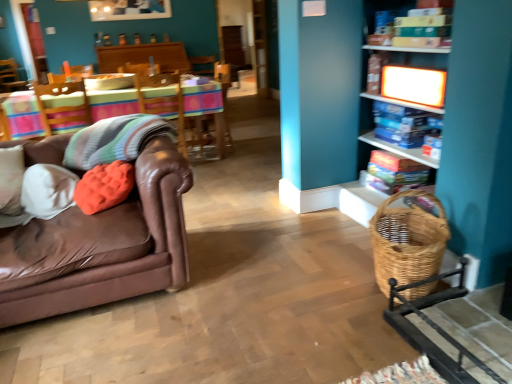
From the picture: Measure the distance between point (85, 149) and camera.

A distance of 2.34 meters exists between point (85, 149) and camera.

Where is `woven brown basket at lower right`? woven brown basket at lower right is located at coordinates (407, 241).

Describe the element at coordinates (407, 241) in the screenshot. This screenshot has width=512, height=384. I see `woven brown basket at lower right` at that location.

What is the approximate height of wooden swivel chair at center, the first swivel chair viewed from the right?

26.73 inches.

The height and width of the screenshot is (384, 512). What are the coordinates of `wooden shelf at right, positioned as the 1th shelf in bottom-to-top order` in the screenshot? It's located at (479, 136).

Between wooden chair at upper left and knitted wool blanket at left, which one has larger size?

With larger size is wooden chair at upper left.

Is wooden chair at upper left outside of knitted wool blanket at left?

Yes.

Considering the points (1, 90) and (119, 118), which point is in front, point (1, 90) or point (119, 118)?

The point (119, 118) is more forward.

From the image's perspective, does wooden chair at upper left appear lower than knitted wool blanket at left?

No.

This screenshot has width=512, height=384. What are the coordinates of `pillow lying in front of the knitted wool blanket at left` in the screenshot? It's located at (104, 186).

Looking at this image, from the image's perspective, is knitted wool blanket at left positioned above or below orange fuzzy pillow at left?

knitted wool blanket at left is above orange fuzzy pillow at left.

From a real-world perspective, between knitted wool blanket at left and orange fuzzy pillow at left, who is vertically lower?

From a 3D spatial view, orange fuzzy pillow at left is below.

Is point (424, 107) farther from viewer compared to point (82, 114)?

No, (424, 107) is in front of (82, 114).

Is white glossy shelf at upper right, which is the 2th shelf in top-to-bottom order, smaller than multicolored fabric swivel chair at left, the 2th swivel chair when ordered from right to left?

Yes.

From the image's perspective, which is above, white glossy shelf at upper right, the second shelf positioned from the bottom, or multicolored fabric swivel chair at left, the 2th swivel chair when ordered from right to left?

multicolored fabric swivel chair at left, the 2th swivel chair when ordered from right to left, is shown above in the image.

From a real-world perspective, is white glossy shelf at upper right, the second shelf positioned from the bottom, located higher than multicolored fabric swivel chair at left, the 2th swivel chair when ordered from right to left?

Yes, from a real-world perspective, white glossy shelf at upper right, the second shelf positioned from the bottom, is over multicolored fabric swivel chair at left, the 2th swivel chair when ordered from right to left

Which object is positioned more to the right, multicolored fabric swivel chair at left, the 2th swivel chair when ordered from right to left, or woven brown basket at lower right?

woven brown basket at lower right is more to the right.

Considering the relative positions of multicolored fabric swivel chair at left, positioned as the 1th swivel chair in left-to-right order, and woven brown basket at lower right in the image provided, is multicolored fabric swivel chair at left, positioned as the 1th swivel chair in left-to-right order, in front of woven brown basket at lower right?

No, multicolored fabric swivel chair at left, positioned as the 1th swivel chair in left-to-right order, is further to the viewer.

Looking at this image, between multicolored fabric swivel chair at left, the 2th swivel chair when ordered from right to left, and woven brown basket at lower right, which one has more height?

multicolored fabric swivel chair at left, the 2th swivel chair when ordered from right to left.

Can we say wooden swivel chair at center, the 2th swivel chair from the left, lies outside woven wicker rocking chair at lower right?

wooden swivel chair at center, the 2th swivel chair from the left, is positioned outside woven wicker rocking chair at lower right.

Is wooden swivel chair at center, the 2th swivel chair from the left, in contact with woven wicker rocking chair at lower right?

No, wooden swivel chair at center, the 2th swivel chair from the left, is not making contact with woven wicker rocking chair at lower right.

Between wooden swivel chair at center, the first swivel chair viewed from the right, and woven wicker rocking chair at lower right, which one has smaller width?

Thinner between the two is wooden swivel chair at center, the first swivel chair viewed from the right.

Which object is more forward, wooden swivel chair at center, the 2th swivel chair from the left, or multicolored fabric swivel chair at left, the 2th swivel chair when ordered from right to left?

multicolored fabric swivel chair at left, the 2th swivel chair when ordered from right to left, is in front.

Is wooden swivel chair at center, the first swivel chair viewed from the right, not within multicolored fabric swivel chair at left, the 2th swivel chair when ordered from right to left?

Yes, wooden swivel chair at center, the first swivel chair viewed from the right, is outside of multicolored fabric swivel chair at left, the 2th swivel chair when ordered from right to left.

Between wooden swivel chair at center, the first swivel chair viewed from the right, and multicolored fabric swivel chair at left, positioned as the 1th swivel chair in left-to-right order, which one has smaller size?

Smaller between the two is multicolored fabric swivel chair at left, positioned as the 1th swivel chair in left-to-right order.

From a real-world perspective, which object rests below the other?

wooden swivel chair at center, the first swivel chair viewed from the right, is physically lower.

Based on the photo, from the image's perspective, would you say wooden chair at upper left is shown under multicolored fabric swivel chair at left, the 2th swivel chair when ordered from right to left?

No, from the image's perspective, wooden chair at upper left is not below multicolored fabric swivel chair at left, the 2th swivel chair when ordered from right to left.

From a real-world perspective, is wooden chair at upper left below multicolored fabric swivel chair at left, positioned as the 1th swivel chair in left-to-right order?

Yes, from a real-world perspective, wooden chair at upper left is below multicolored fabric swivel chair at left, positioned as the 1th swivel chair in left-to-right order.

Is wooden chair at upper left looking in the opposite direction of multicolored fabric swivel chair at left, positioned as the 1th swivel chair in left-to-right order?

wooden chair at upper left is not turned away from multicolored fabric swivel chair at left, positioned as the 1th swivel chair in left-to-right order.

The width and height of the screenshot is (512, 384). Find the location of `chair lying behind the knitted wool blanket at left`. chair lying behind the knitted wool blanket at left is located at coordinates (x=10, y=76).

Identify the location of pillow in front of the knitted wool blanket at left. This screenshot has width=512, height=384. (104, 186).

From the picture: When comparing their distances from wooden table at center, does brown leather couch at left or wooden swivel chair at center, the 2th swivel chair from the left, seem further?

brown leather couch at left.

Consider the image. Considering their positions, is brown leather couch at left positioned closer to wooden chair at upper left than wooden swivel chair at center, the first swivel chair viewed from the right?

wooden swivel chair at center, the first swivel chair viewed from the right.

When comparing their distances from wooden swivel chair at center, the 2th swivel chair from the left, does wooden table at center or woven wicker rocking chair at lower right seem further?

Among the two, woven wicker rocking chair at lower right is located further to wooden swivel chair at center, the 2th swivel chair from the left.

Based on their spatial positions, is woven brown basket at lower right or white glossy shelf at upper right, which is the 2th shelf in top-to-bottom order, further from brown leather couch at left?

white glossy shelf at upper right, which is the 2th shelf in top-to-bottom order, is further to brown leather couch at left.

Estimate the real-world distances between objects in this image. Which object is closer to wooden shelf at right, which is the 3th shelf from top to bottom, woven brown basket at lower right or white glossy shelf at upper right, which is the 2th shelf in top-to-bottom order?

woven brown basket at lower right is positioned closer to the anchor wooden shelf at right, which is the 3th shelf from top to bottom.

When comparing their distances from woven brown basket at lower right, does woven wicker rocking chair at lower right or wooden shelf at right, positioned as the 1th shelf in bottom-to-top order, seem closer?

woven wicker rocking chair at lower right lies closer to woven brown basket at lower right than the other object.

Estimate the real-world distances between objects in this image. Which object is further from wooden bookshelf at upper right, which is counted as the 3th shelf, starting from the bottom, wooden chair at upper left or wooden shelf at right, positioned as the 1th shelf in bottom-to-top order?

wooden chair at upper left is positioned further to the anchor wooden bookshelf at upper right, which is counted as the 3th shelf, starting from the bottom.

Looking at the image, which one is located closer to woven wicker rocking chair at lower right, orange fuzzy pillow at left or white glossy shelf at upper right, which is the 2th shelf in top-to-bottom order?

Among the two, white glossy shelf at upper right, which is the 2th shelf in top-to-bottom order, is located nearer to woven wicker rocking chair at lower right.

The image size is (512, 384). I want to click on studio couch between multicolored fabric swivel chair at left, positioned as the 1th swivel chair in left-to-right order, and wooden bookshelf at upper right, which is counted as the 3th shelf, starting from the bottom, in the horizontal direction, so (x=102, y=229).

Image resolution: width=512 pixels, height=384 pixels. Find the location of `blanket located between brown leather couch at left and woven brown basket at lower right in the left-right direction`. blanket located between brown leather couch at left and woven brown basket at lower right in the left-right direction is located at coordinates (114, 140).

At what (x,y) coordinates should I click in order to perform the action: click on pillow between brown leather couch at left and woven brown basket at lower right from left to right. Please return your answer as a coordinate pair (x, y). Looking at the image, I should click on (104, 186).

Where is `swivel chair between multicolored fabric swivel chair at left, positioned as the 1th swivel chair in left-to-right order, and wooden chair at upper left, along the z-axis`? swivel chair between multicolored fabric swivel chair at left, positioned as the 1th swivel chair in left-to-right order, and wooden chair at upper left, along the z-axis is located at coordinates (163, 102).